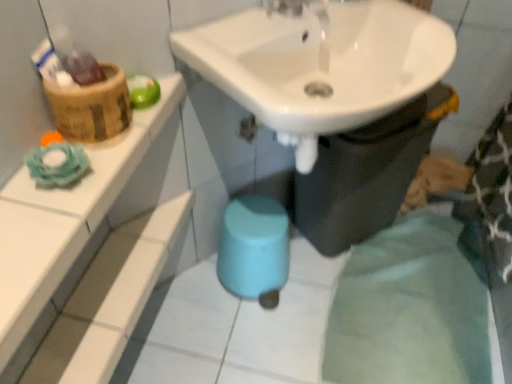
Question: Considering their positions, is white glossy sink at upper center located in front of or behind white glossy sink at center?

Choices:
 (A) front
 (B) behind

Answer: (A)

Question: Is white glossy sink at upper center wider or thinner than white glossy sink at center?

Choices:
 (A) wide
 (B) thin

Answer: (A)

Question: Estimate the real-world distances between objects in this image. Which object is closer to the wooden basket at upper left?

Choices:
 (A) white glossy tile at upper left
 (B) white glossy sink at upper center
 (C) white glossy sink at center

Answer: (A)

Question: Which object is the closest to the wooden basket at upper left?

Choices:
 (A) white glossy tile at upper left
 (B) white glossy sink at upper center
 (C) white glossy sink at center

Answer: (A)